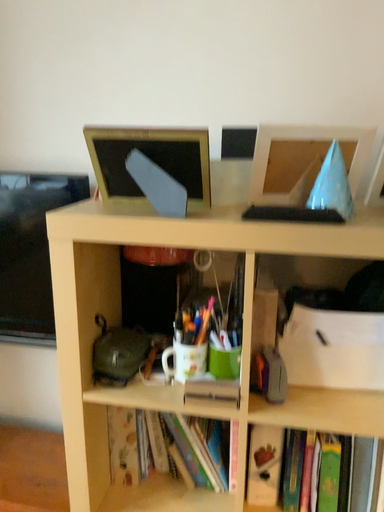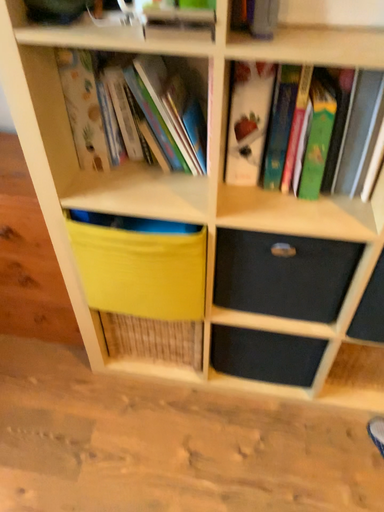
Question: How did the camera likely rotate when shooting the video?

Choices:
 (A) rotated downward
 (B) rotated upward

Answer: (A)